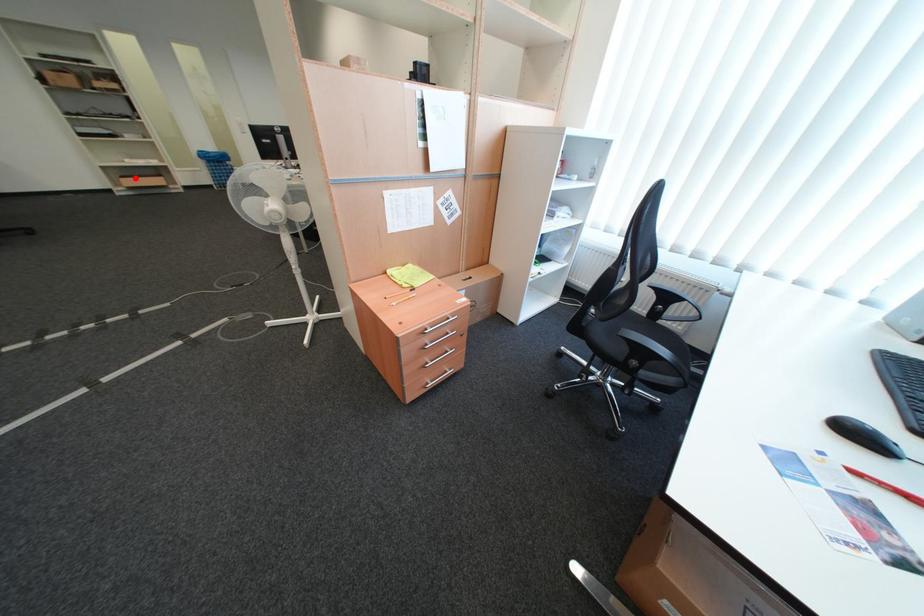
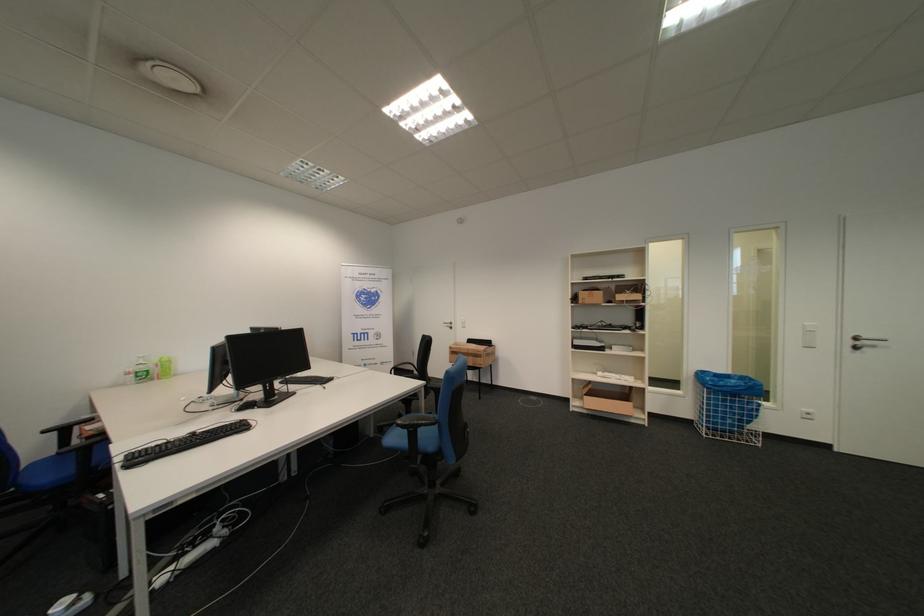
Locate, in the second image, the point that corresponds to the highlighted location in the first image.

(601, 395)